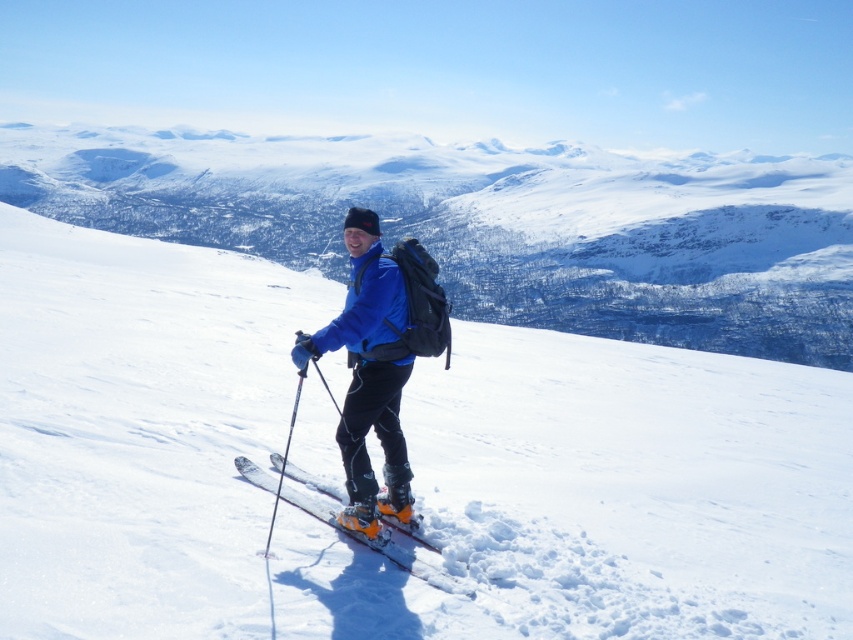
You are a photographer trying to capture the skier and the mountain in one shot. Since you want both the skier and the mountain to be in focus, you need to adjust your camera settings. Considering the white snow mountain at center and orange matte skis at center, which object is closer to the camera?

The orange matte skis at center are closer to the camera than the white snow mountain at center because the mountain is positioned over the skis, indicating it is farther away.

You are a photographer planning to take a photo of the white snow mountain at center and the orange matte skis at center. Which object should you focus on first if you want to capture both in sharp detail?

The white snow mountain at center is bigger than the orange matte skis at center, so you should focus on the white snow mountain at center first to ensure it is in sharp detail before adjusting for the smaller object.

You are a photographer planning to capture the skier in the scene. You want to ensure the orange matte skis at center and white powder snow at center are both visible in the frame. Given their widths, which object will occupy more horizontal space in the photo?

The white powder snow at center has a greater width than the orange matte skis at center, so it will occupy more horizontal space in the photo.